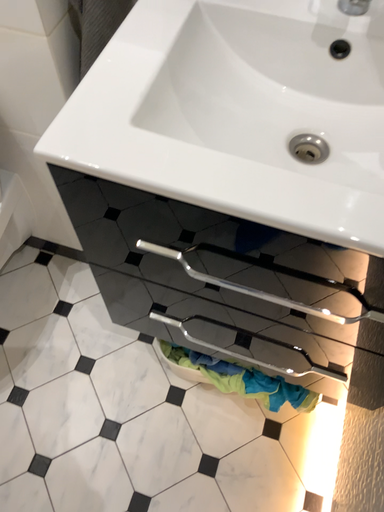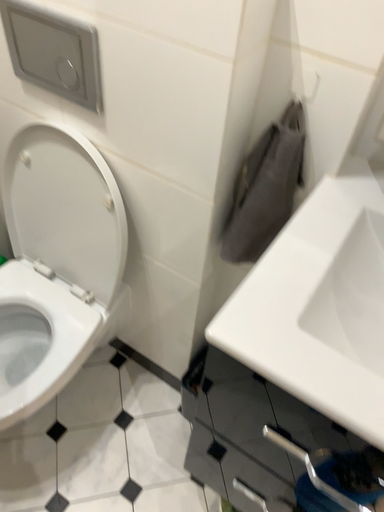
Question: Which way did the camera rotate in the video?

Choices:
 (A) rotated upward
 (B) rotated downward

Answer: (A)